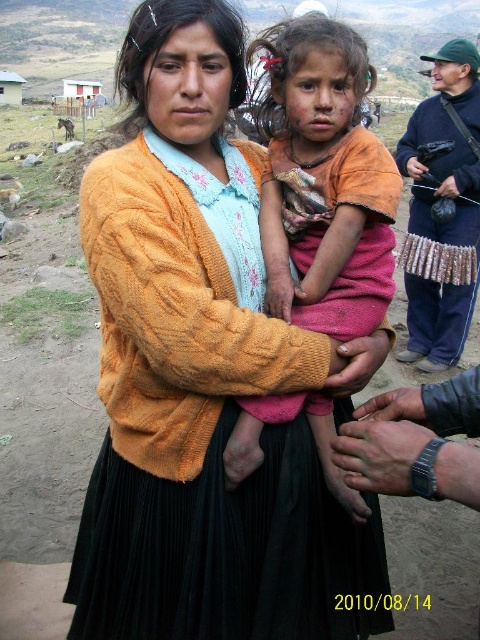
In the scene shown: You are a photographer trying to decide where to place your metallic silver camera at right so it doesn,t block the view of the black knit dress at center. Based on their sizes, which object should be positioned closer to the foreground?

The black knit dress at center has a smaller size compared to the metallic silver camera at right. To prevent the camera from blocking the dress, the metallic silver camera at right should be placed closer to the foreground so its larger size doesn,t obscure the smaller dress.

You are a photographer who wants to take a picture of the black knit dress at center and the metallic silver camera at right. Based on their positions, which object is closer to the left side of the frame?

The black knit dress at center is positioned on the left side of the metallic silver camera at right, so it is closer to the left side of the frame.